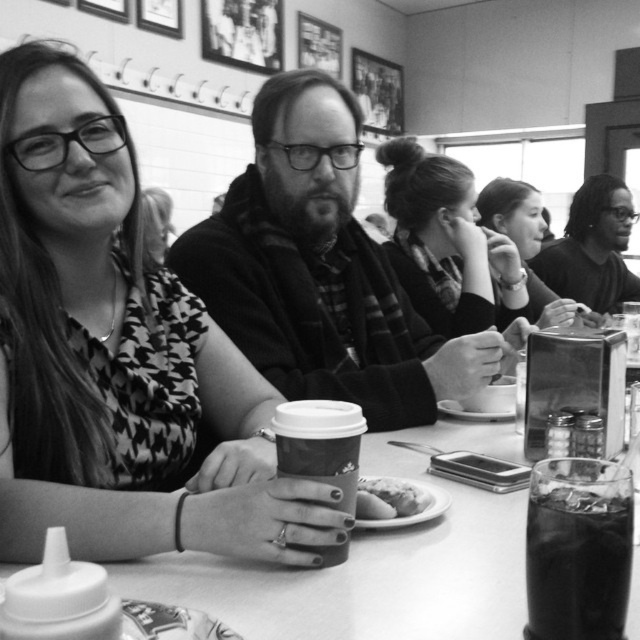
You are a delivery person who needs to place a small package between the matte black hoodie at center and the smooth plastic cup at center. The package is 15 inches long. Can you fit it between them without moving either object?

The matte black hoodie at center and smooth plastic cup at center are 14.92 inches apart from each other. Since the package is 15 inches long, it cannot fit between them as the distance is slightly less than the package length.

You are a photographer adjusting your camera settings to focus on two points in the image. The first point is point (93, 413) and the second is point (312, 435). Which point is closer to the camera lens?

Point (93, 413) is closer to the camera lens than point (312, 435) because it is further to the camera.